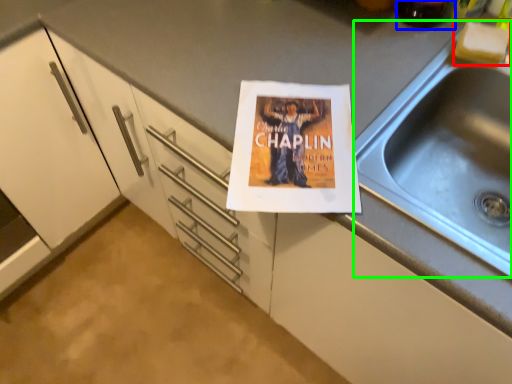
Question: Which is farther away from food (highlighted by a red box)? beverage (highlighted by a blue box) or sink (highlighted by a green box)?

Choices:
 (A) beverage
 (B) sink

Answer: (B)